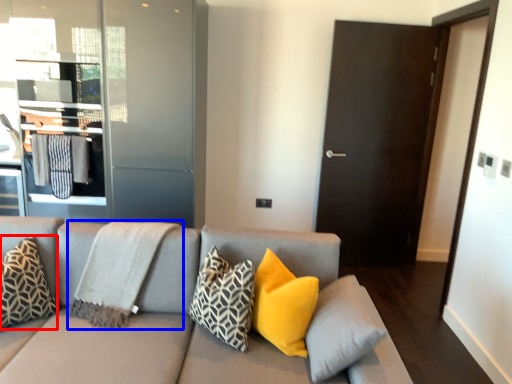
Question: Which object is further to the camera taking this photo, pillow (highlighted by a red box) or blanket (highlighted by a blue box)?

Choices:
 (A) pillow
 (B) blanket

Answer: (B)